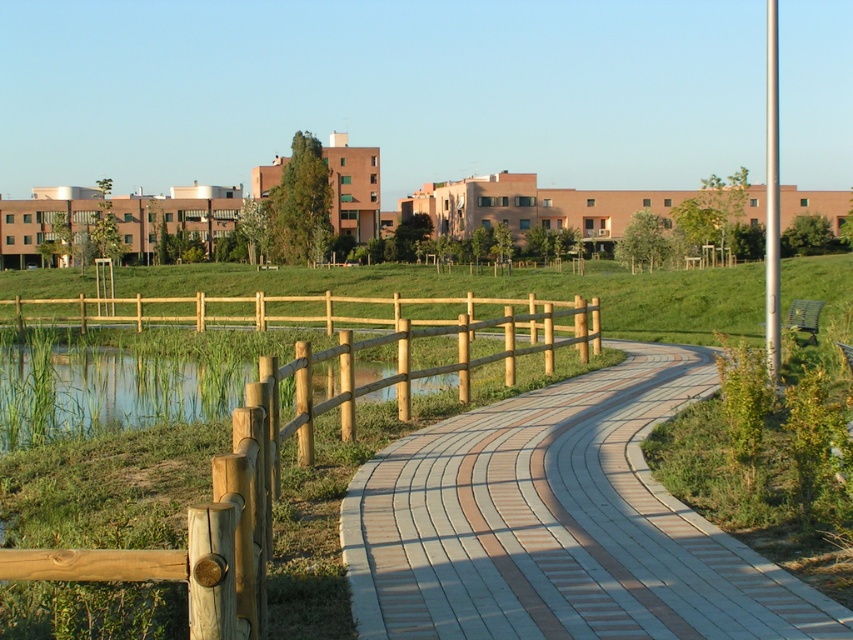
From the picture: Can you confirm if brick paved path at center is taller than wooden fence at left?

No.

Looking at this image, between brick paved path at center and wooden fence at left, which one has more height?

With more height is wooden fence at left.

At what (x,y) coordinates should I click in order to perform the action: click on brick paved path at center. Please return your answer as a coordinate pair (x, y). Image resolution: width=853 pixels, height=640 pixels. Looking at the image, I should click on (560, 524).